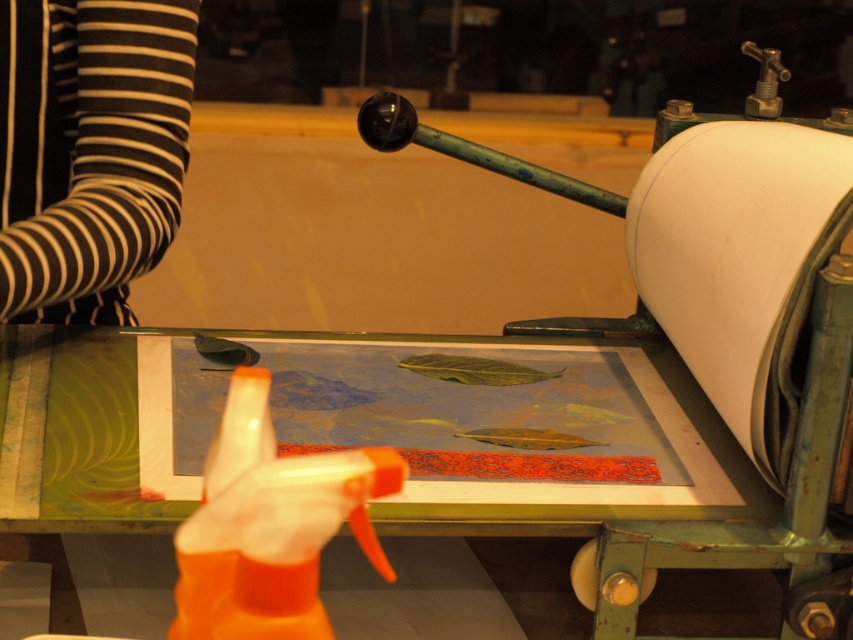
Is black striped fabric at upper left to the right of white paper at right from the viewer's perspective?

In fact, black striped fabric at upper left is to the left of white paper at right.

Is point (132, 10) closer to viewer compared to point (718, 234)?

No, it is behind (718, 234).

Where is `black striped fabric at upper left`? The width and height of the screenshot is (853, 640). black striped fabric at upper left is located at coordinates (90, 150).

You are a GUI agent. You are given a task and a screenshot of the screen. Output one action in this format:
    pyautogui.click(x=<x>, y=<y>)
    Task: Click on the black striped fabric at upper left
    The height and width of the screenshot is (640, 853).
    Given the screenshot: What is the action you would take?
    coord(90,150)